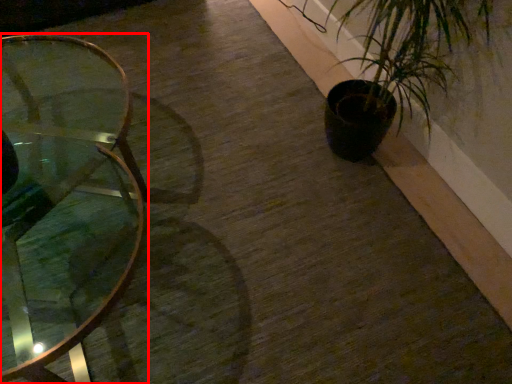
Question: In this image, where is table (annotated by the red box) located relative to houseplant?

Choices:
 (A) left
 (B) right

Answer: (A)